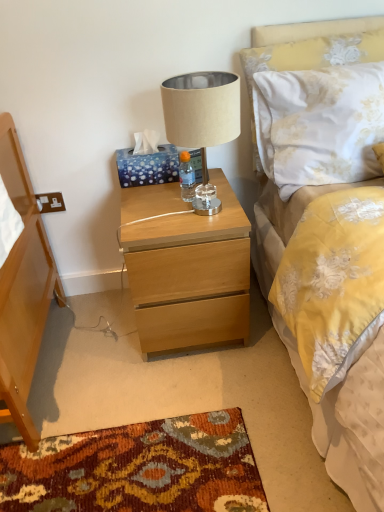
Locate an element on the screen. free space to the left of clear plastic bottle at center is located at coordinates (148, 200).